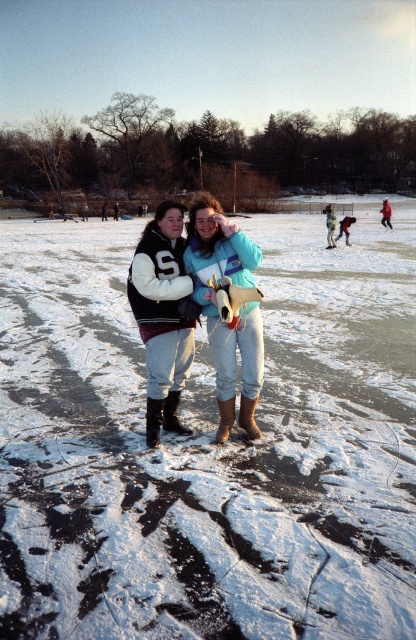
Question: Does white fleece jacket at center appear under matte blue jacket at center?

Choices:
 (A) yes
 (B) no

Answer: (A)

Question: Which object appears farthest from the camera in this image?

Choices:
 (A) white fleece jacket at center
 (B) white matte snow at center
 (C) matte blue jacket at center

Answer: (A)

Question: Which object is positioned farthest from the matte blue jacket at center?

Choices:
 (A) white matte snow at center
 (B) white fleece jacket at center

Answer: (A)

Question: Is white fleece jacket at center to the right of matte blue jacket at center from the viewer's perspective?

Choices:
 (A) yes
 (B) no

Answer: (B)

Question: In this image, where is white matte snow at center located relative to matte blue jacket at center?

Choices:
 (A) below
 (B) above

Answer: (B)

Question: Which object is closer to the camera taking this photo?

Choices:
 (A) white matte snow at center
 (B) white fleece jacket at center
 (C) matte blue jacket at center

Answer: (A)